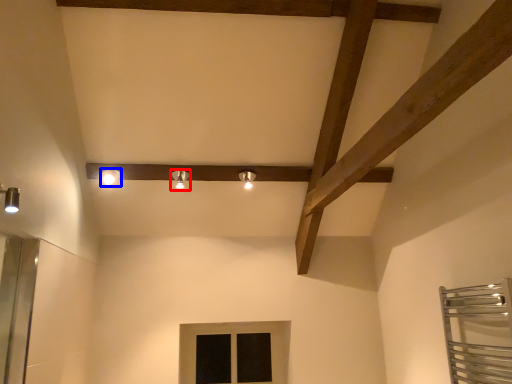
Question: Which of the following is the closest to the observer, light fixture (highlighted by a red box) or light fixture (highlighted by a blue box)?

Choices:
 (A) light fixture
 (B) light fixture

Answer: (B)